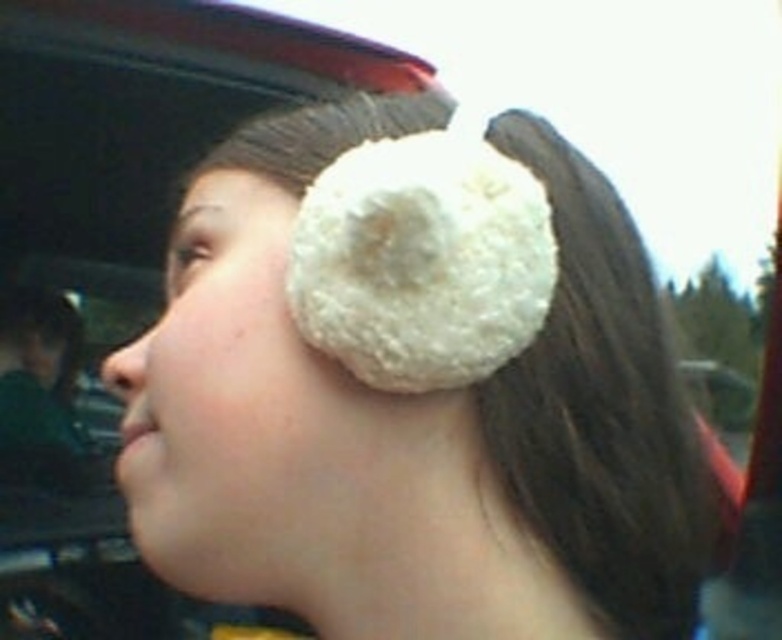
You are a photographer trying to capture the exact position of the white fluffy earmuffs at upper right in the image. According to the coordinates provided, where would you focus your camera lens to center the earmuffs?

The white fluffy earmuffs at upper right are positioned at coordinates point (413, 387), so you should focus your camera lens at that exact point to center them.

You are a photographer adjusting the focus on your camera. You notice two white fluffy earmuffs at upper right and white fluffy ear muffs at upper right in the frame. Which one is closer to the camera lens?

The white fluffy earmuffs at upper right is closer to the camera lens than the white fluffy ear muffs at upper right by 1.95 inches.

You are a photographer who wants to adjust the lighting to highlight both the white fluffy earmuffs at upper right and the white fluffy ear muffs at upper right. Since they are positioned differently, which one is located lower and needs more direct light to avoid being overshadowed?

The white fluffy earmuffs at upper right is below the white fluffy ear muffs at upper right, so it needs more direct light to avoid being overshadowed.